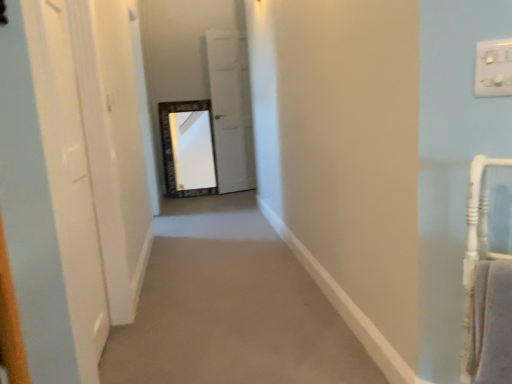
Question: Does white plastic switch at upper right have a greater height compared to white matte door at center, the 1th door positioned from the right?

Choices:
 (A) no
 (B) yes

Answer: (A)

Question: Is white plastic switch at upper right not close to white matte door at center, the 2th door when ordered from front to back?

Choices:
 (A) yes
 (B) no

Answer: (A)

Question: From the image's perspective, is white plastic switch at upper right below white matte door at center, the 2th door when ordered from front to back?

Choices:
 (A) yes
 (B) no

Answer: (A)

Question: Is white plastic switch at upper right bigger than white matte door at center, the 2th door in the left-to-right sequence?

Choices:
 (A) no
 (B) yes

Answer: (A)

Question: Is white plastic switch at upper right next to white matte door at center, the 1th door positioned from the right?

Choices:
 (A) no
 (B) yes

Answer: (A)

Question: Choose the correct answer: Is white matte door at center, the first door when ordered from back to front, inside white plastic switch at upper right or outside it?

Choices:
 (A) inside
 (B) outside

Answer: (B)

Question: Is white matte door at center, the 2th door in the left-to-right sequence, to the left or to the right of white plastic switch at upper right in the image?

Choices:
 (A) left
 (B) right

Answer: (A)

Question: Is point 230,99 positioned closer to the camera than point 495,72?

Choices:
 (A) farther
 (B) closer

Answer: (A)

Question: Is white matte door at center, the 1th door positioned from the right, wider or thinner than white plastic switch at upper right?

Choices:
 (A) wide
 (B) thin

Answer: (A)

Question: Considering the positions of white plastic switch at upper right and white matte door at center, the 2th door in the left-to-right sequence, in the image, is white plastic switch at upper right taller or shorter than white matte door at center, the 2th door in the left-to-right sequence,?

Choices:
 (A) tall
 (B) short

Answer: (B)

Question: Looking at the image, does white plastic switch at upper right seem bigger or smaller compared to white matte door at center, the 2th door when ordered from front to back?

Choices:
 (A) small
 (B) big

Answer: (A)

Question: Which is correct: white plastic switch at upper right is inside white matte door at center, the 1th door positioned from the right, or outside of it?

Choices:
 (A) inside
 (B) outside

Answer: (B)

Question: In the image, is white plastic switch at upper right on the left side or the right side of white matte door at center, the 2th door in the left-to-right sequence?

Choices:
 (A) left
 (B) right

Answer: (B)

Question: Is white plastic switch at upper right bigger or smaller than white glossy door at left, acting as the first door starting from the front?

Choices:
 (A) big
 (B) small

Answer: (B)

Question: From a real-world perspective, relative to white glossy door at left, marked as the 1th door in a left-to-right arrangement, is white plastic switch at upper right vertically above or below?

Choices:
 (A) below
 (B) above

Answer: (B)